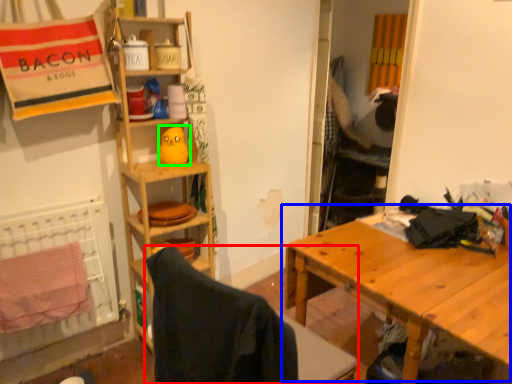
Question: Considering the real-world distances, which object is farthest from folding chair (highlighted by a red box)? table (highlighted by a blue box) or toy (highlighted by a green box)?

Choices:
 (A) table
 (B) toy

Answer: (B)